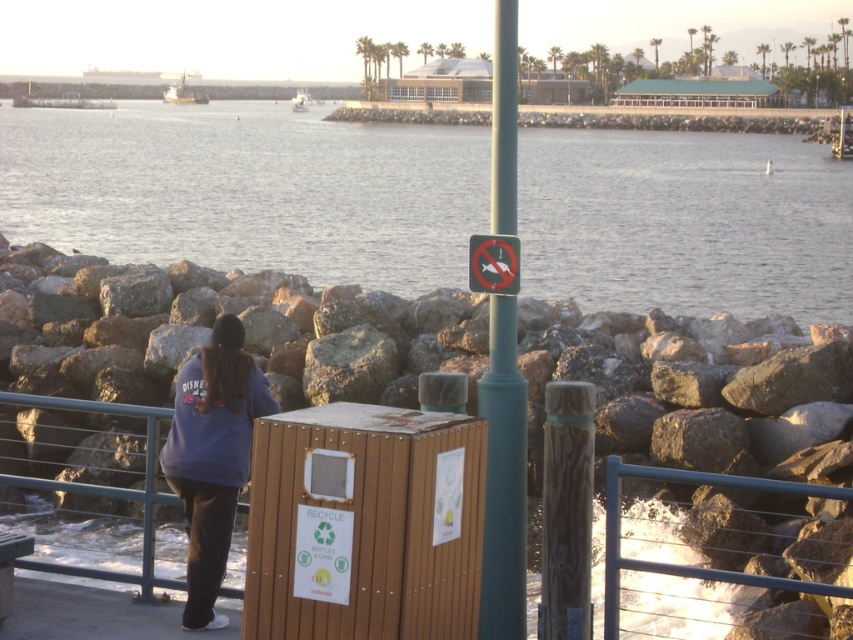
You are a visitor at the waterfront and want to dispose of a recyclable bottle. You see the wooden trash bin at center and the purple fleece jacket at lower left. Which direction should you move to reach the trash bin?

The wooden trash bin at center is positioned on the right side of purple fleece jacket at lower left. So you should move to your right to reach the wooden trash bin at center.

You are standing on the walkway and want to throw a recyclable bottle into the wooden trash bin at center. However, there is a green metallic pole at center in the way. Which direction should you move to avoid the pole and reach the bin?

The wooden trash bin at center is to the left of the green metallic pole at center, so you should move to the left to avoid the pole and reach the bin.